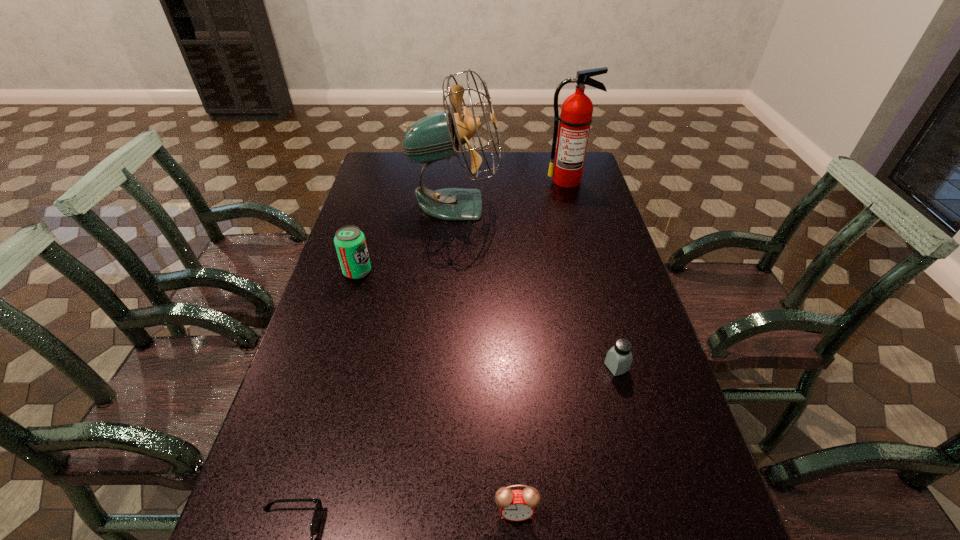
Locate an element on the screen. fan located at the far edge is located at coordinates (436, 137).

The image size is (960, 540). Identify the location of fire extinguisher at the far edge. (576, 117).

Where is `object at the left edge`? The image size is (960, 540). object at the left edge is located at coordinates (350, 243).

Locate an element on the screen. The image size is (960, 540). fire extinguisher present at the right edge is located at coordinates (576, 117).

This screenshot has width=960, height=540. In order to click on saltshaker situated at the right edge in this screenshot , I will do `click(619, 358)`.

Find the location of a particular element. The width and height of the screenshot is (960, 540). object located at the far right corner is located at coordinates tap(576, 117).

In the image, there is a desktop. Where is `vacant space at the far edge`? vacant space at the far edge is located at coordinates (492, 164).

Identify the location of free space at the left edge of the desktop. This screenshot has height=540, width=960. (323, 460).

Identify the location of free point at the right edge. Image resolution: width=960 pixels, height=540 pixels. (666, 394).

The image size is (960, 540). In order to click on unoccupied area between the alarm clock and the fan in this screenshot , I will do `click(486, 358)`.